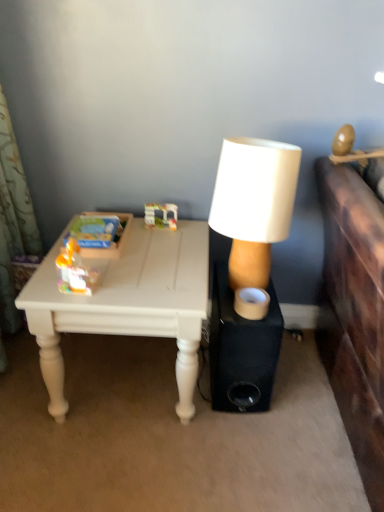
Question: Considering the relative sizes of translucent plastic toy at center, arranged as the 1th toy when viewed from the top, and white matte lamp at center in the image provided, is translucent plastic toy at center, arranged as the 1th toy when viewed from the top, thinner than white matte lamp at center?

Choices:
 (A) yes
 (B) no

Answer: (A)

Question: From the image's perspective, is translucent plastic toy at center, which is the first toy in back-to-front order, above white matte lamp at center?

Choices:
 (A) no
 (B) yes

Answer: (B)

Question: From the image's perspective, is translucent plastic toy at center, arranged as the first toy when viewed from the right, beneath white matte lamp at center?

Choices:
 (A) yes
 (B) no

Answer: (B)

Question: Can you confirm if translucent plastic toy at center, the 2th toy when ordered from left to right, is positioned to the left of white matte lamp at center?

Choices:
 (A) yes
 (B) no

Answer: (A)

Question: Is translucent plastic toy at center, arranged as the 1th toy when viewed from the top, far away from white matte lamp at center?

Choices:
 (A) yes
 (B) no

Answer: (B)

Question: From the image's perspective, is black matte speaker at center above or below white matte lamp at center?

Choices:
 (A) below
 (B) above

Answer: (A)

Question: Is black matte speaker at center taller or shorter than white matte lamp at center?

Choices:
 (A) short
 (B) tall

Answer: (A)

Question: Is black matte speaker at center in front of or behind white matte lamp at center in the image?

Choices:
 (A) front
 (B) behind

Answer: (B)

Question: Which is correct: black matte speaker at center is inside white matte lamp at center, or outside of it?

Choices:
 (A) outside
 (B) inside

Answer: (A)

Question: Is point (66, 274) positioned closer to the camera than point (167, 222)?

Choices:
 (A) farther
 (B) closer

Answer: (B)

Question: From a real-world perspective, is matte plastic toy at left, the 2th toy when ordered from back to front, positioned above or below translucent plastic toy at center, marked as the 2th toy in a front-to-back arrangement?

Choices:
 (A) below
 (B) above

Answer: (B)

Question: From the image's perspective, relative to translucent plastic toy at center, the 2th toy in the bottom-to-top sequence, is matte plastic toy at left, the 2th toy when ordered from back to front, above or below?

Choices:
 (A) above
 (B) below

Answer: (B)

Question: Considering the positions of matte plastic toy at left, the 2th toy when ordered from back to front, and translucent plastic toy at center, the 2th toy in the bottom-to-top sequence, in the image, is matte plastic toy at left, the 2th toy when ordered from back to front, wider or thinner than translucent plastic toy at center, the 2th toy in the bottom-to-top sequence,?

Choices:
 (A) thin
 (B) wide

Answer: (B)

Question: Is point (150, 204) positioned closer to the camera than point (74, 266)?

Choices:
 (A) farther
 (B) closer

Answer: (A)

Question: In terms of width, does translucent plastic toy at center, marked as the 2th toy in a front-to-back arrangement, look wider or thinner when compared to matte plastic toy at left, the 2th toy when ordered from back to front?

Choices:
 (A) wide
 (B) thin

Answer: (B)